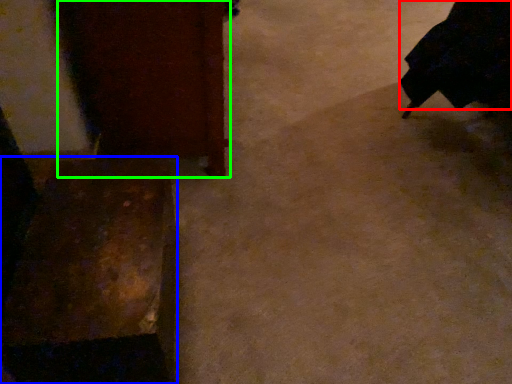
Question: Estimate the real-world distances between objects in this image. Which object is farther from robe (highlighted by a red box), furniture (highlighted by a blue box) or furniture (highlighted by a green box)?

Choices:
 (A) furniture
 (B) furniture

Answer: (A)